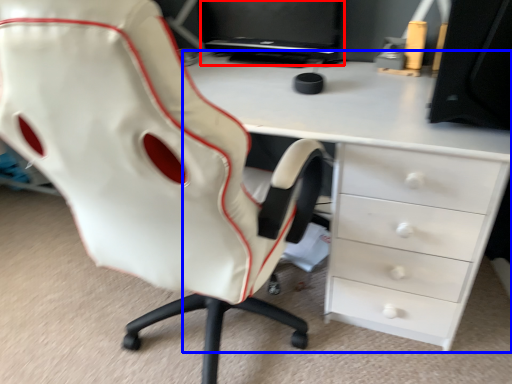
Question: Which of the following is the closest to the observer, computer monitor (highlighted by a red box) or desk (highlighted by a blue box)?

Choices:
 (A) computer monitor
 (B) desk

Answer: (B)